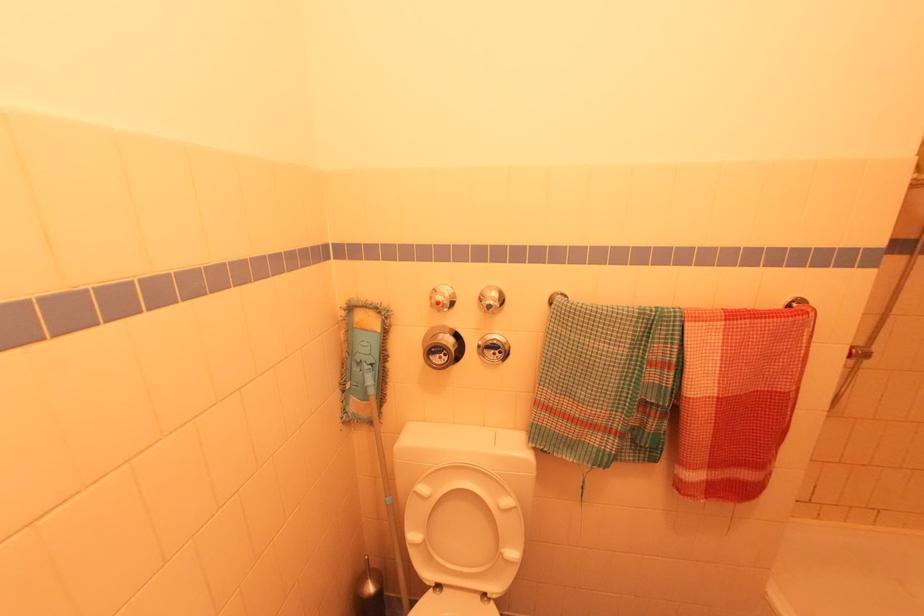
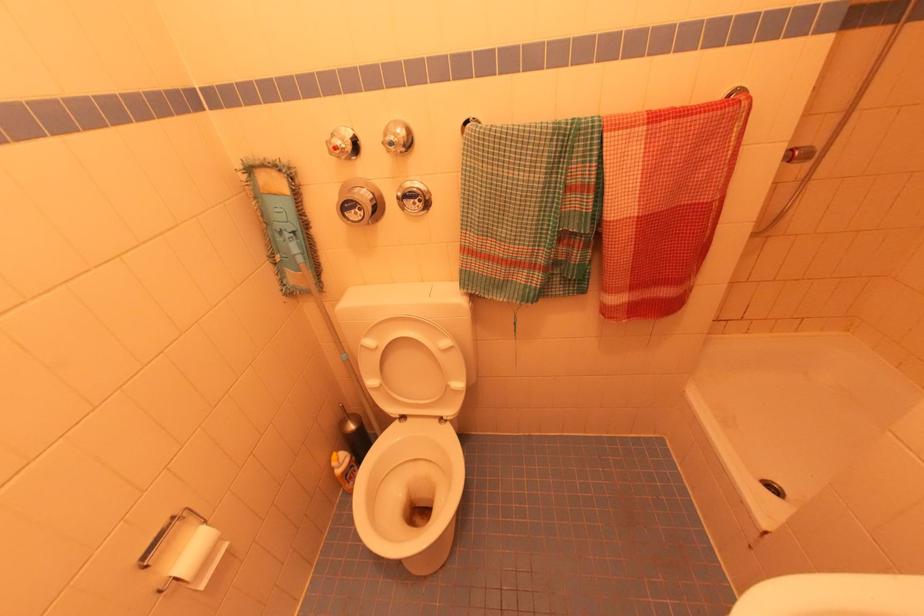
Question: What movement of the cameraman would produce the second image?

Choices:
 (A) Left
 (B) Right
 (C) Forward
 (D) Backward

Answer: (B)